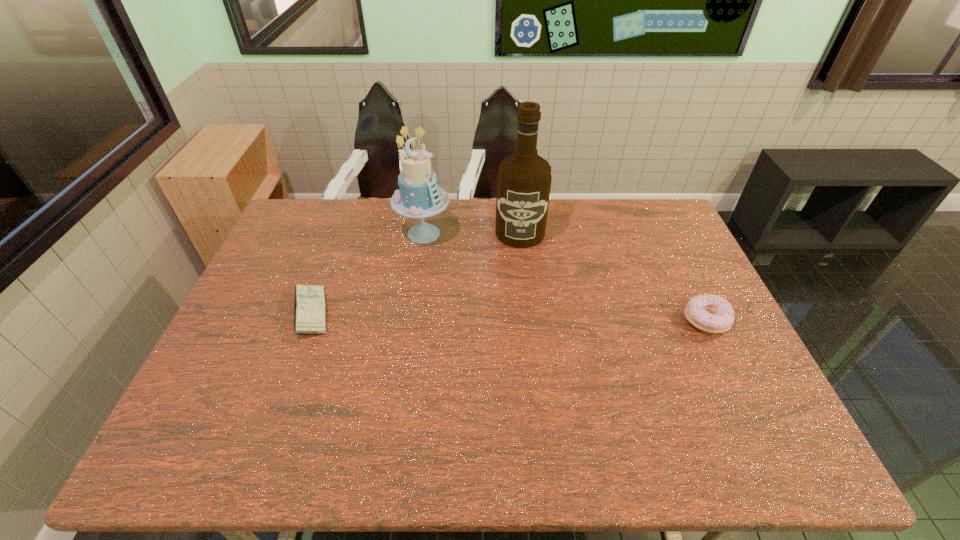
Identify the location of free region located on the label of the alcohol. (516, 297).

At what (x,y) coordinates should I click in order to perform the action: click on free space located 0.080m on the label of the alcohol. Please return your answer as a coordinate pair (x, y). This screenshot has width=960, height=540. Looking at the image, I should click on (518, 265).

At what (x,y) coordinates should I click in order to perform the action: click on free space located 0.050m on the label of the alcohol. Please return your answer as a coordinate pair (x, y). Looking at the image, I should click on (518, 259).

Locate an element on the screen. Image resolution: width=960 pixels, height=540 pixels. cake that is at the far edge is located at coordinates (419, 196).

Where is `alcohol at the far edge`? The height and width of the screenshot is (540, 960). alcohol at the far edge is located at coordinates (524, 178).

You are a GUI agent. You are given a task and a screenshot of the screen. Output one action in this format:
    pyautogui.click(x=<x>, y=<y>)
    Task: Click on the object present at the left edge
    This screenshot has width=960, height=540.
    Given the screenshot: What is the action you would take?
    pyautogui.click(x=309, y=304)

Identify the location of object that is positioned at the right edge. This screenshot has height=540, width=960. (710, 313).

This screenshot has height=540, width=960. In the image, there is a desktop. What are the coordinates of `vacant space at the far edge` in the screenshot? It's located at (447, 207).

The width and height of the screenshot is (960, 540). I want to click on vacant area at the near edge, so [590, 387].

Where is `free space at the left edge of the desktop`? free space at the left edge of the desktop is located at coordinates click(275, 336).